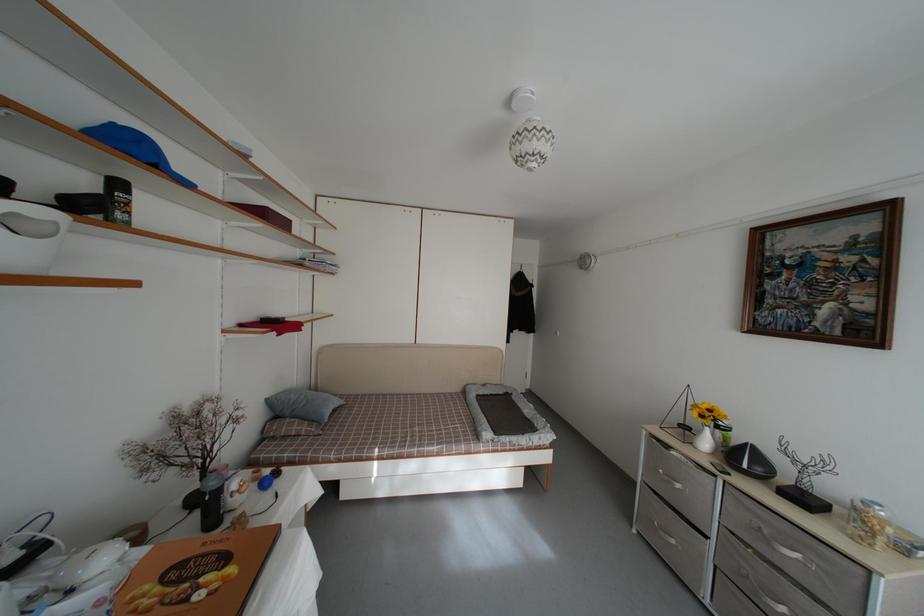
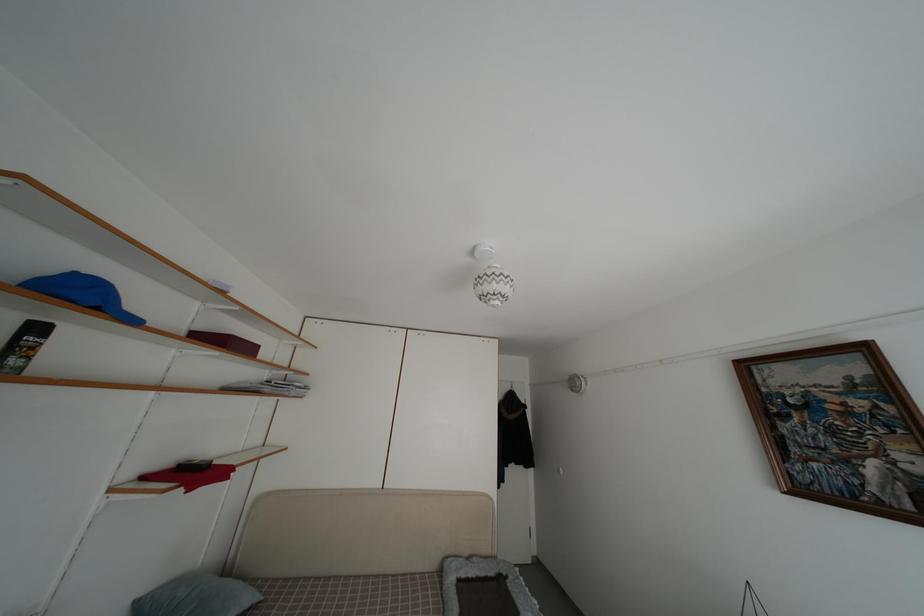
What movement of the cameraman would produce the second image?

The cameraman walked toward right, forward.